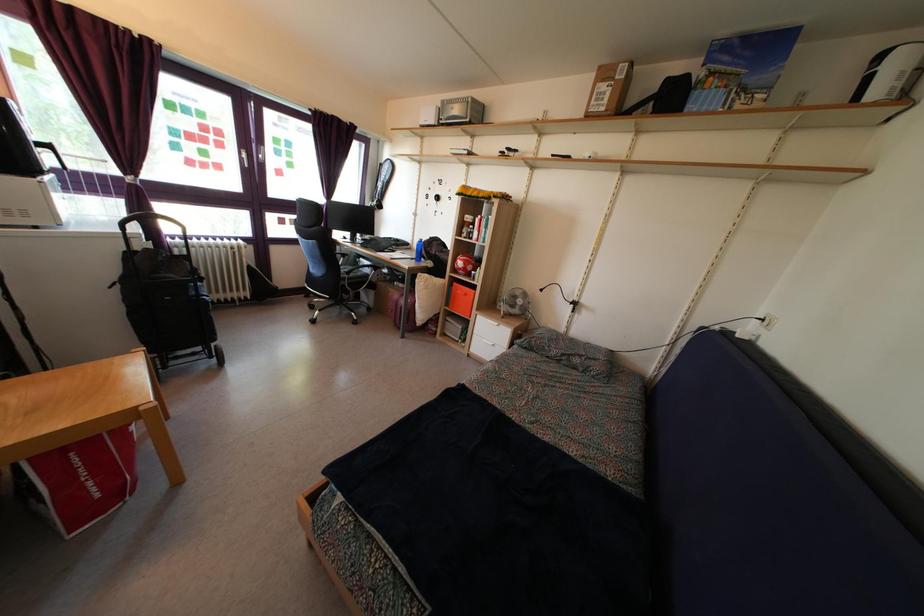
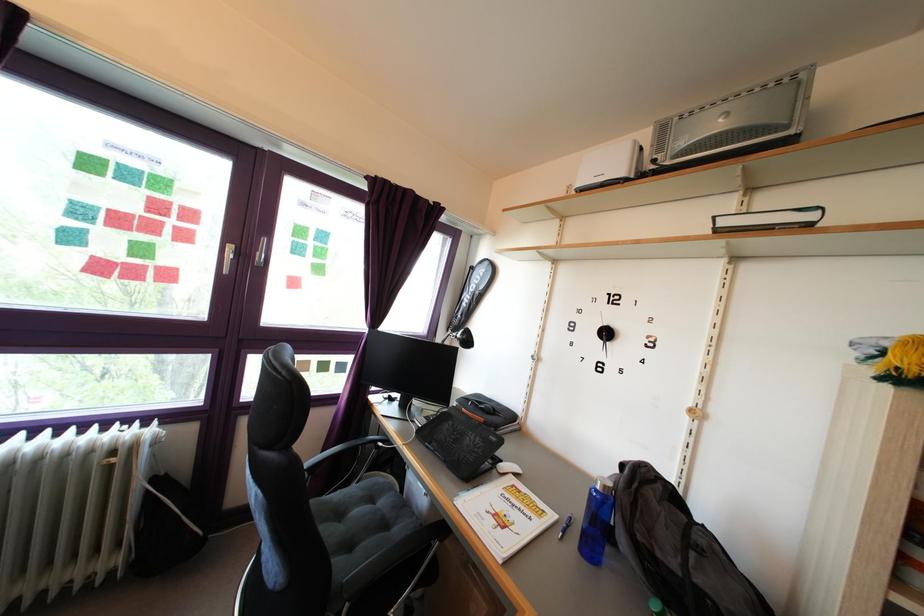
Where in the second image is the point corresponding to [386,253] from the first image?

(472, 447)